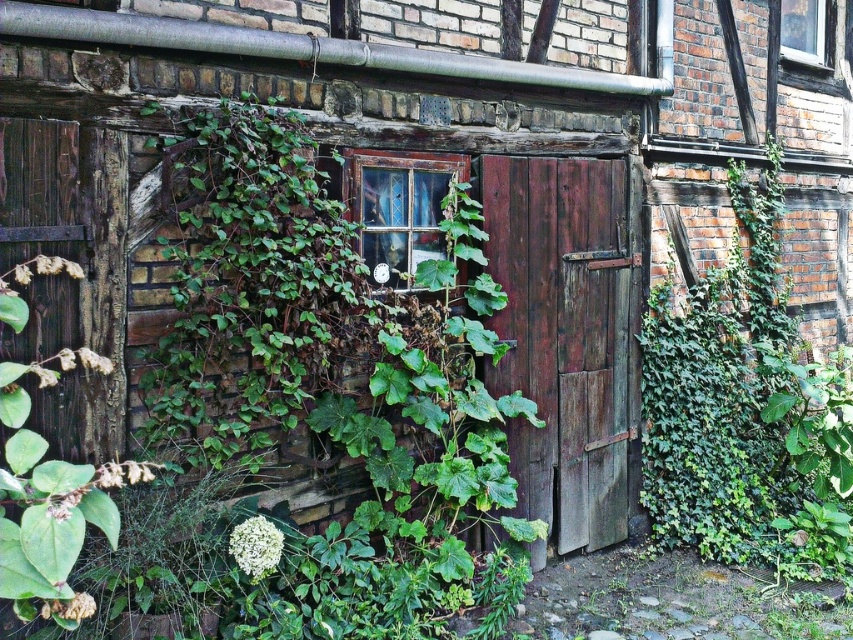
Who is higher up, translucent glass window at center or clear glass window at upper right?

Positioned higher is clear glass window at upper right.

Does translucent glass window at center have a lesser width compared to clear glass window at upper right?

Yes.

This screenshot has width=853, height=640. Describe the element at coordinates (399, 209) in the screenshot. I see `translucent glass window at center` at that location.

I want to click on translucent glass window at center, so click(x=399, y=209).

Who is taller, weathered wood door at center or clear glass window at upper right?

With more height is weathered wood door at center.

Is weathered wood door at center positioned in front of clear glass window at upper right?

Yes, it is in front of clear glass window at upper right.

Locate an element on the screen. The image size is (853, 640). weathered wood door at center is located at coordinates (564, 337).

Who is more distant from viewer, [579,358] or [405,237]?

The point [579,358] is more distant.

Does weathered wood door at center have a lesser height compared to translucent glass window at center?

No, weathered wood door at center is not shorter than translucent glass window at center.

Find the location of a particular element. weathered wood door at center is located at coordinates (564, 337).